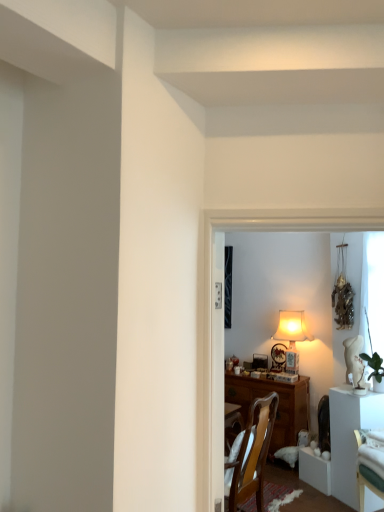
Question: Is point (365, 415) positioned closer to the camera than point (382, 369)?

Choices:
 (A) closer
 (B) farther

Answer: (A)

Question: Which is correct: white glossy table at right is inside green leafy plant at right, or outside of it?

Choices:
 (A) inside
 (B) outside

Answer: (B)

Question: Looking at the image, does white glossy table at right seem bigger or smaller compared to green leafy plant at right?

Choices:
 (A) big
 (B) small

Answer: (A)

Question: In the image, is green leafy plant at right positioned in front of or behind white glossy table at right?

Choices:
 (A) behind
 (B) front

Answer: (A)

Question: In terms of width, does green leafy plant at right look wider or thinner when compared to white glossy table at right?

Choices:
 (A) thin
 (B) wide

Answer: (A)

Question: From the image's perspective, is green leafy plant at right above or below white glossy table at right?

Choices:
 (A) below
 (B) above

Answer: (B)

Question: Considering the positions of green leafy plant at right and white glossy table at right in the image, is green leafy plant at right taller or shorter than white glossy table at right?

Choices:
 (A) short
 (B) tall

Answer: (A)